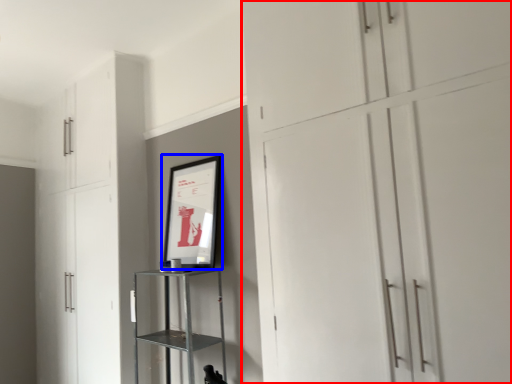
Question: Among these objects, which one is farthest to the camera, cupboard (highlighted by a red box) or picture frame (highlighted by a blue box)?

Choices:
 (A) cupboard
 (B) picture frame

Answer: (B)